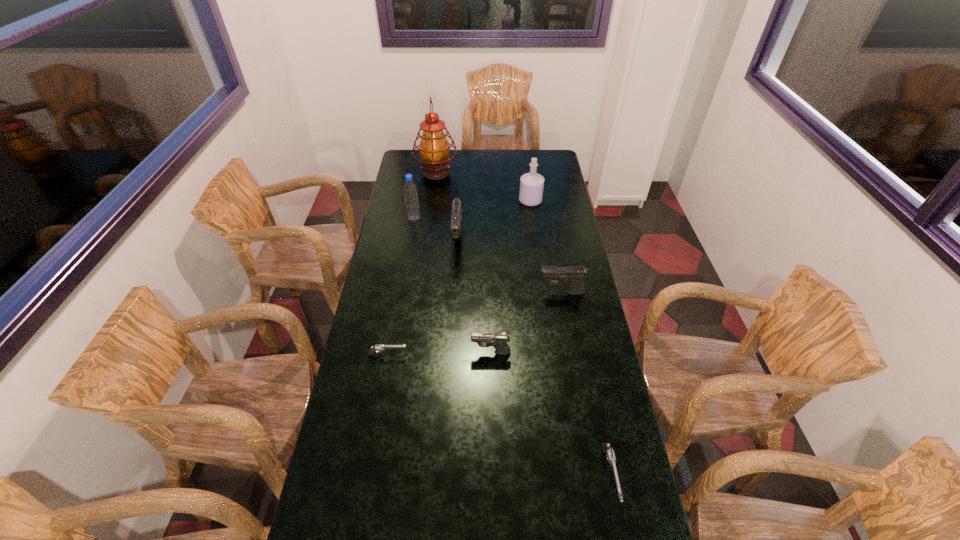
Where is `free space located at the barrel of the fifth farthest object`? free space located at the barrel of the fifth farthest object is located at coordinates (435, 293).

Image resolution: width=960 pixels, height=540 pixels. Find the location of `vacant space situated at the barrel of the fifth farthest object`. vacant space situated at the barrel of the fifth farthest object is located at coordinates (494, 293).

You are a GUI agent. You are given a task and a screenshot of the screen. Output one action in this format:
    pyautogui.click(x=<x>, y=<y>)
    Task: Click on the free space located 0.360m at the barrel of the third shortest pistol
    
    Given the screenshot: What is the action you would take?
    pyautogui.click(x=366, y=352)

The width and height of the screenshot is (960, 540). I want to click on free space located at the barrel of the third shortest pistol, so click(396, 352).

Identify the location of free space located at the barrel of the third shortest pistol. The image size is (960, 540). (407, 352).

The height and width of the screenshot is (540, 960). In order to click on free space located on the front-facing side of the smaller silver pistol in this screenshot , I will do `click(498, 355)`.

Identify the location of object located in the far edge section of the desktop. The width and height of the screenshot is (960, 540). (434, 149).

Find the location of `oil lamp present at the left edge`. oil lamp present at the left edge is located at coordinates (434, 149).

At what (x,y) coordinates should I click in order to perform the action: click on water bottle that is at the left edge. Please return your answer as a coordinate pair (x, y). The width and height of the screenshot is (960, 540). Looking at the image, I should click on (410, 189).

Where is `pistol situated at the left edge`? Image resolution: width=960 pixels, height=540 pixels. pistol situated at the left edge is located at coordinates (373, 349).